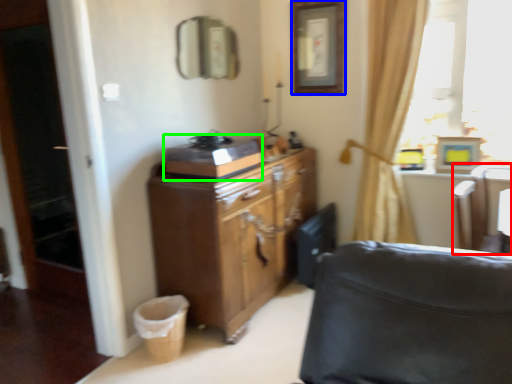
Question: Which object is positioned farthest from swivel chair (highlighted by a red box)? Select from picture frame (highlighted by a blue box) and appliance (highlighted by a green box).

Choices:
 (A) picture frame
 (B) appliance

Answer: (B)